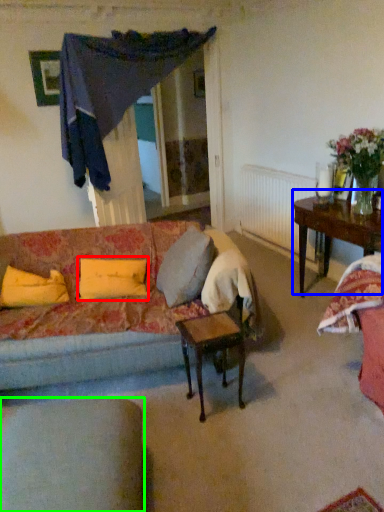
Question: Based on their relative distances, which object is nearer to pillow (highlighted by a red box)? Choose from table (highlighted by a blue box) and chair (highlighted by a green box).

Choices:
 (A) table
 (B) chair

Answer: (B)